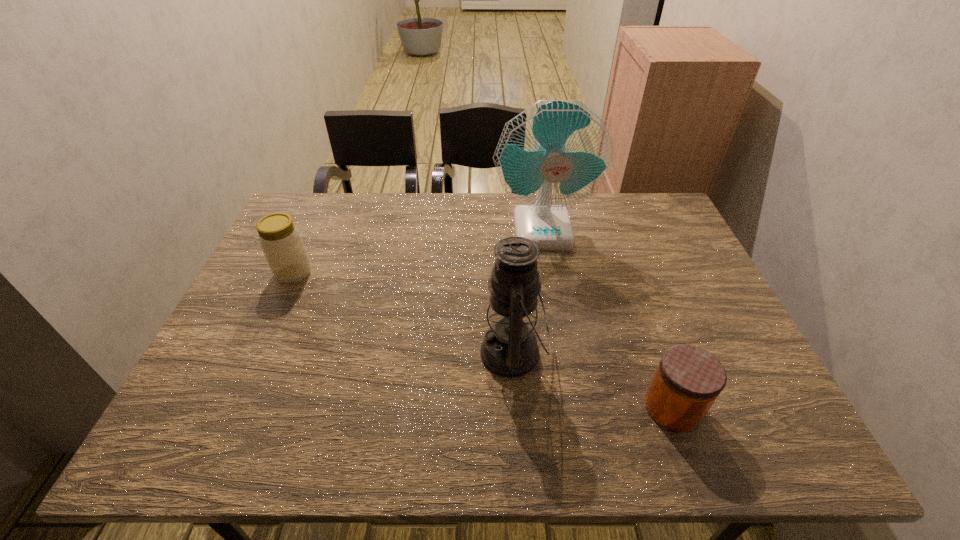
At what (x,y) coordinates should I click in order to perform the action: click on vacant space located 0.130m on the right of the shorter jar. Please return your answer as a coordinate pair (x, y). The width and height of the screenshot is (960, 540). Looking at the image, I should click on (762, 408).

Find the location of a particular element. object at the far edge is located at coordinates (557, 153).

The height and width of the screenshot is (540, 960). Identify the location of object at the near edge. (688, 380).

You are a GUI agent. You are given a task and a screenshot of the screen. Output one action in this format:
    pyautogui.click(x=<x>, y=<y>)
    Task: Click on the object present at the left edge
    
    Given the screenshot: What is the action you would take?
    pyautogui.click(x=280, y=240)

The width and height of the screenshot is (960, 540). I want to click on object present at the right edge, so coord(688,380).

Locate an element on the screen. object that is at the near right corner is located at coordinates (688, 380).

In the image, there is a desktop. At what (x,y) coordinates should I click in order to perform the action: click on free space at the far edge. Please return your answer as a coordinate pair (x, y). The image size is (960, 540). Looking at the image, I should click on (444, 199).

Identify the location of free space at the near edge of the desktop. The height and width of the screenshot is (540, 960). (259, 438).

The width and height of the screenshot is (960, 540). I want to click on vacant region at the left edge, so click(x=235, y=381).

The height and width of the screenshot is (540, 960). Identify the location of free space at the right edge of the desktop. (733, 358).